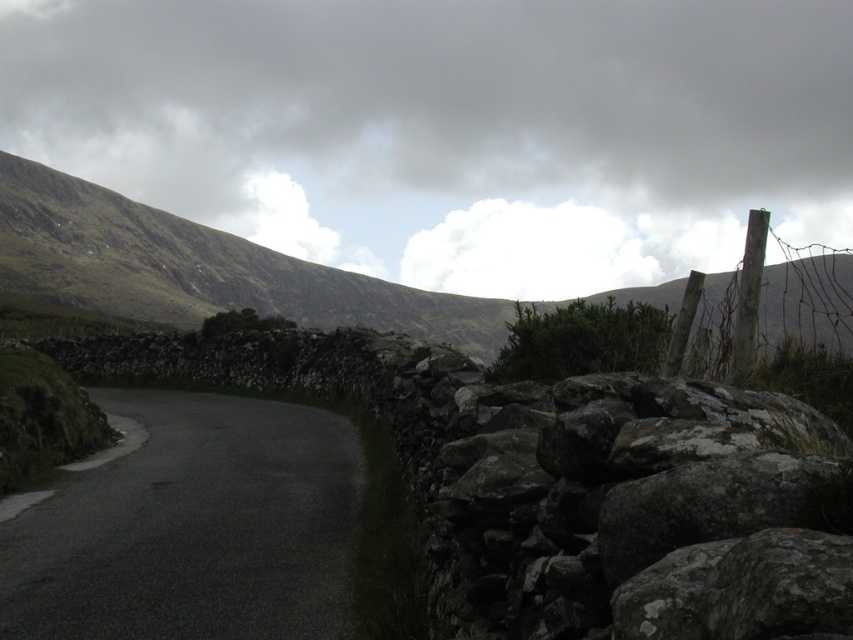
Which of these two, white fluffy cloud at upper center or gray rough stone at right, stands shorter?

gray rough stone at right

Who is more forward, (519, 294) or (613, 627)?

Point (613, 627)

Locate an element on the screen. white fluffy cloud at upper center is located at coordinates (451, 129).

Between gray rough stone at right and dark asphalt road at lower left, which one has less height?

dark asphalt road at lower left

Is gray rough stone at right smaller than dark asphalt road at lower left?

Correct, gray rough stone at right occupies less space than dark asphalt road at lower left.

Is point (448, 417) closer to viewer compared to point (221, 572)?

Yes.

Identify the location of gray rough stone at right. (637, 508).

Who is higher up, white fluffy cloud at upper center or dark asphalt road at lower left?

white fluffy cloud at upper center

Can you confirm if white fluffy cloud at upper center is wider than dark asphalt road at lower left?

Correct, the width of white fluffy cloud at upper center exceeds that of dark asphalt road at lower left.

Where is `white fluffy cloud at upper center`? This screenshot has height=640, width=853. white fluffy cloud at upper center is located at coordinates (451, 129).

Where is `white fluffy cloud at upper center`? white fluffy cloud at upper center is located at coordinates (451, 129).